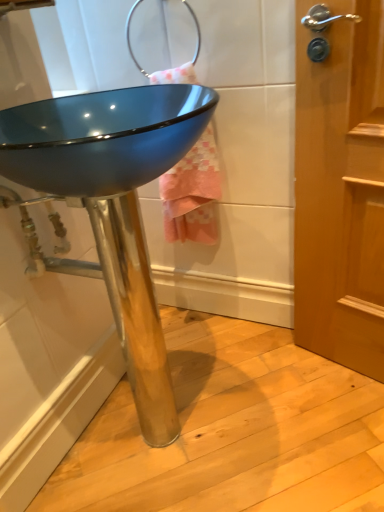
Question: From a real-world perspective, is glossy blue basin at center above or below pink textured towel at upper center?

Choices:
 (A) below
 (B) above

Answer: (A)

Question: Is glossy blue basin at center inside the boundaries of pink textured towel at upper center, or outside?

Choices:
 (A) outside
 (B) inside

Answer: (A)

Question: Looking at the image, does glossy blue basin at center seem bigger or smaller compared to pink textured towel at upper center?

Choices:
 (A) small
 (B) big

Answer: (B)

Question: In terms of height, does pink textured towel at upper center look taller or shorter compared to glossy blue basin at center?

Choices:
 (A) short
 (B) tall

Answer: (A)

Question: Considering the positions of point (162, 192) and point (54, 109), is point (162, 192) closer or farther from the camera than point (54, 109)?

Choices:
 (A) farther
 (B) closer

Answer: (A)

Question: Relative to glossy blue basin at center, is pink textured towel at upper center in front or behind?

Choices:
 (A) front
 (B) behind

Answer: (B)

Question: From a real-world perspective, is pink textured towel at upper center above or below glossy blue basin at center?

Choices:
 (A) above
 (B) below

Answer: (A)